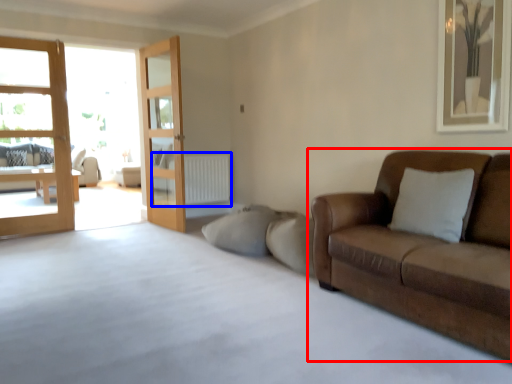
Question: Among these objects, which one is nearest to the camera, studio couch (highlighted by a red box) or radiator (highlighted by a blue box)?

Choices:
 (A) studio couch
 (B) radiator

Answer: (A)